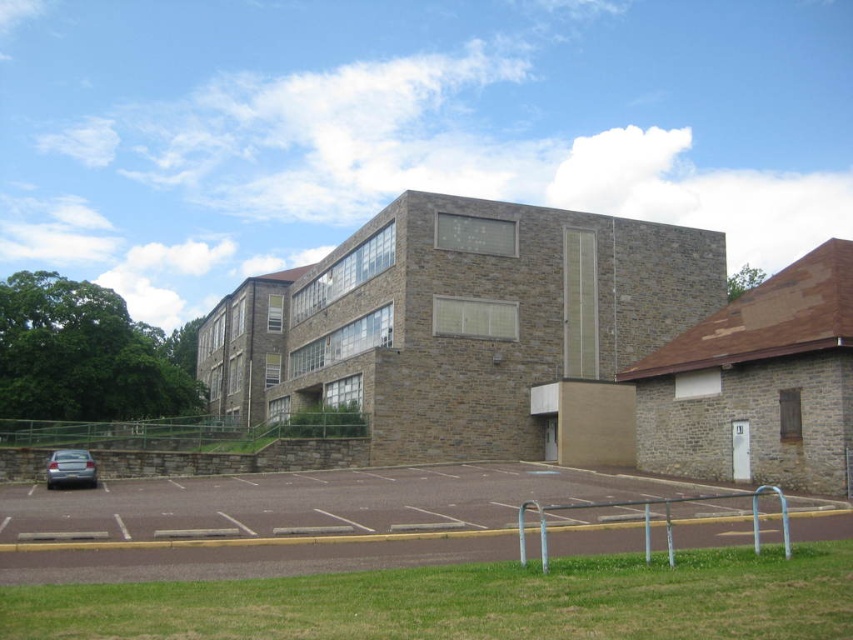
Does brown asphalt parking lot at lower center have a lesser height compared to satin silver sedan at lower left?

In fact, brown asphalt parking lot at lower center may be taller than satin silver sedan at lower left.

Does point (495, 529) come behind point (61, 452)?

No, (495, 529) is closer to viewer.

The width and height of the screenshot is (853, 640). Identify the location of brown asphalt parking lot at lower center. (283, 520).